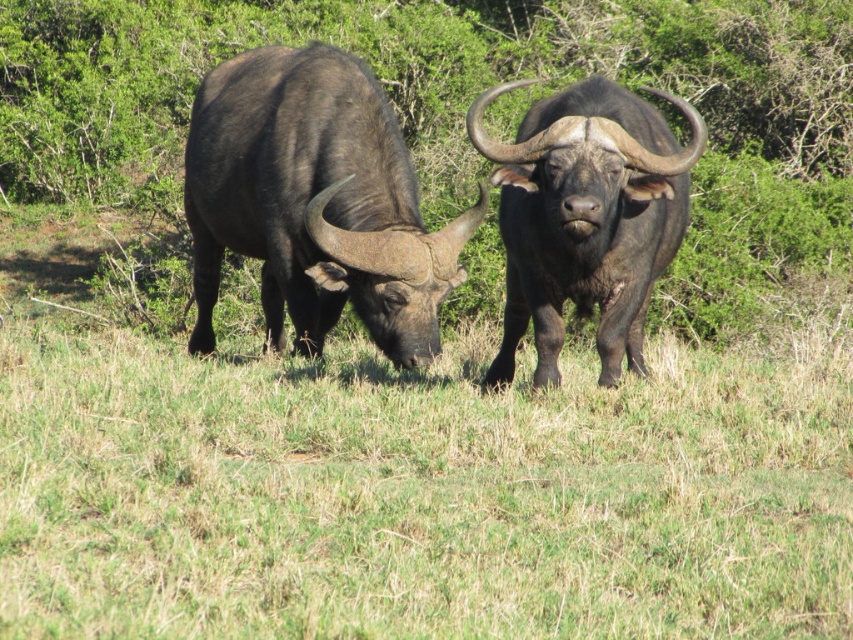
Question: Estimate the real-world distances between objects in this image. Which object is farther from the shiny dark brown bull at center?

Choices:
 (A) green grass at lower center
 (B) shiny black bull at left

Answer: (B)

Question: Is green grass at lower center smaller than shiny dark brown bull at center?

Choices:
 (A) no
 (B) yes

Answer: (A)

Question: Which object is the farthest from the shiny black bull at left?

Choices:
 (A) green grass at lower center
 (B) shiny dark brown bull at center

Answer: (A)

Question: Where is green grass at lower center located in relation to shiny dark brown bull at center in the image?

Choices:
 (A) right
 (B) left

Answer: (B)

Question: Which object appears farthest from the camera in this image?

Choices:
 (A) shiny dark brown bull at center
 (B) green grass at lower center
 (C) shiny black bull at left

Answer: (C)

Question: From the image, what is the correct spatial relationship of green grass at lower center in relation to shiny black bull at left?

Choices:
 (A) left
 (B) right

Answer: (B)